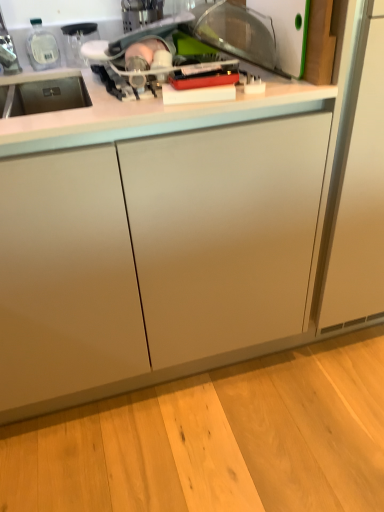
Question: Does white plastic cutting board at upper right touch white glossy countertop at upper center?

Choices:
 (A) yes
 (B) no

Answer: (B)

Question: Considering the relative sizes of white plastic cutting board at upper right and white glossy countertop at upper center in the image provided, is white plastic cutting board at upper right thinner than white glossy countertop at upper center?

Choices:
 (A) yes
 (B) no

Answer: (A)

Question: Is white plastic cutting board at upper right looking in the opposite direction of white glossy countertop at upper center?

Choices:
 (A) yes
 (B) no

Answer: (B)

Question: Considering the relative positions of white plastic cutting board at upper right and white glossy countertop at upper center in the image provided, is white plastic cutting board at upper right to the left of white glossy countertop at upper center from the viewer's perspective?

Choices:
 (A) yes
 (B) no

Answer: (B)

Question: Is white plastic cutting board at upper right located outside white glossy countertop at upper center?

Choices:
 (A) yes
 (B) no

Answer: (A)

Question: Can you confirm if white plastic cutting board at upper right is positioned to the right of white glossy countertop at upper center?

Choices:
 (A) yes
 (B) no

Answer: (A)

Question: Is white glossy countertop at upper center at the right side of white plastic cutting board at upper right?

Choices:
 (A) yes
 (B) no

Answer: (B)

Question: Is white glossy countertop at upper center shorter than white plastic cutting board at upper right?

Choices:
 (A) no
 (B) yes

Answer: (A)

Question: Does white glossy countertop at upper center have a greater height compared to white plastic cutting board at upper right?

Choices:
 (A) no
 (B) yes

Answer: (B)

Question: Is white glossy countertop at upper center positioned before white plastic cutting board at upper right?

Choices:
 (A) yes
 (B) no

Answer: (A)

Question: Could white plastic cutting board at upper right be considered to be inside white glossy countertop at upper center?

Choices:
 (A) yes
 (B) no

Answer: (B)

Question: From the image's perspective, is white glossy countertop at upper center over white plastic cutting board at upper right?

Choices:
 (A) no
 (B) yes

Answer: (A)

Question: From the image's perspective, relative to white plastic cutting board at upper right, is white glossy countertop at upper center above or below?

Choices:
 (A) above
 (B) below

Answer: (B)